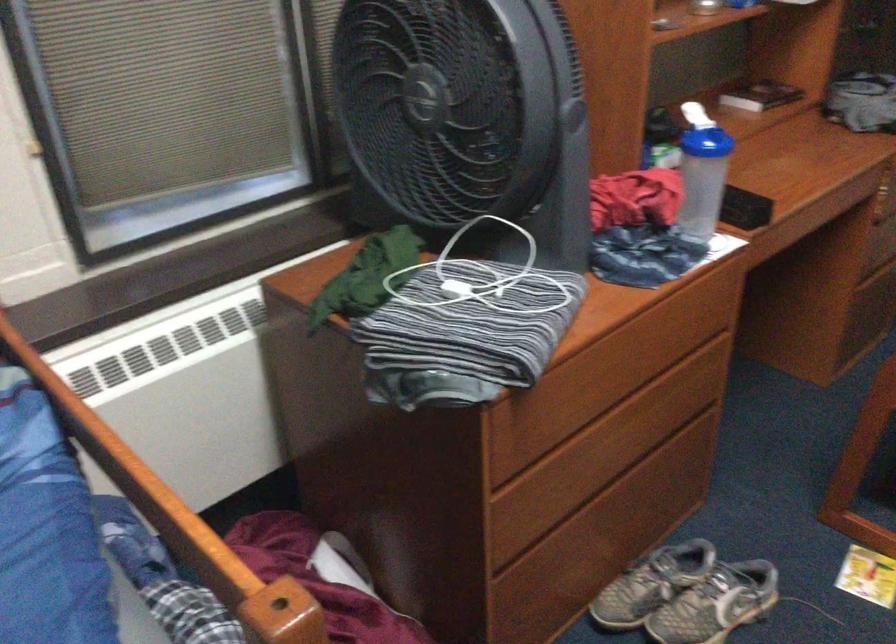
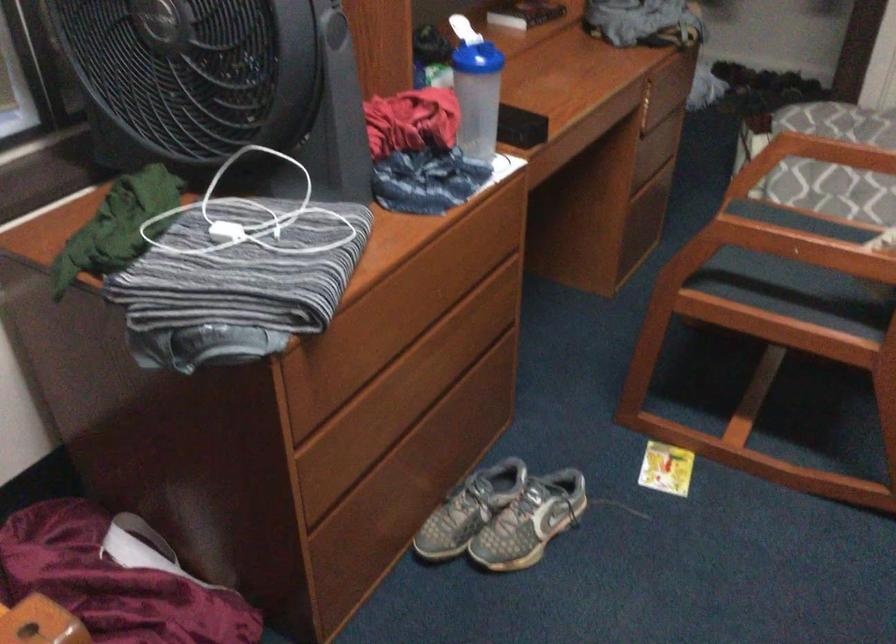
Find the pixel in the second image that matches [595,402] in the first image.

(393, 339)